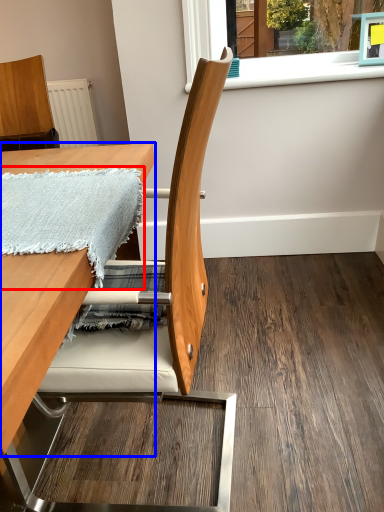
Question: Which point is closer to the camera, blanket (highlighted by a red box) or table (highlighted by a blue box)?

Choices:
 (A) blanket
 (B) table

Answer: (B)